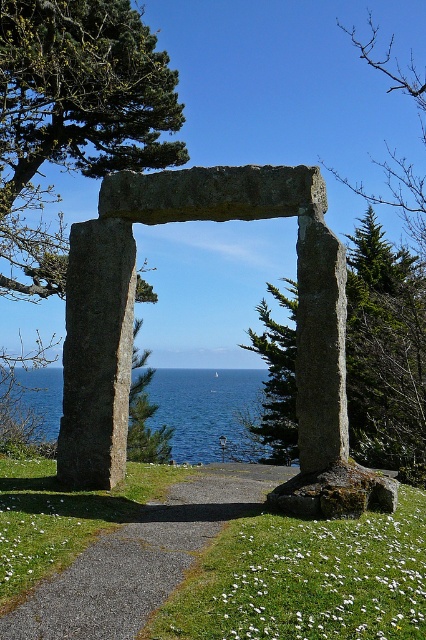
Question: Can you confirm if green mossy stone at center is thinner than gravel path at center?

Choices:
 (A) no
 (B) yes

Answer: (A)

Question: Which object is farther from the camera taking this photo?

Choices:
 (A) blue water at center
 (B) gravel path at center
 (C) smooth gray stone pillar at center

Answer: (A)

Question: Which point is farther from the camera taking this photo?

Choices:
 (A) (92, 404)
 (B) (238, 400)
 (C) (199, 524)

Answer: (B)

Question: Among these objects, which one is nearest to the camera?

Choices:
 (A) blue water at center
 (B) gravel path at center
 (C) green mossy stone at center

Answer: (B)

Question: Is granite stone arch at center above gravel path at center?

Choices:
 (A) yes
 (B) no

Answer: (A)

Question: Is green mossy stone at center in front of blue water at center?

Choices:
 (A) no
 (B) yes

Answer: (B)